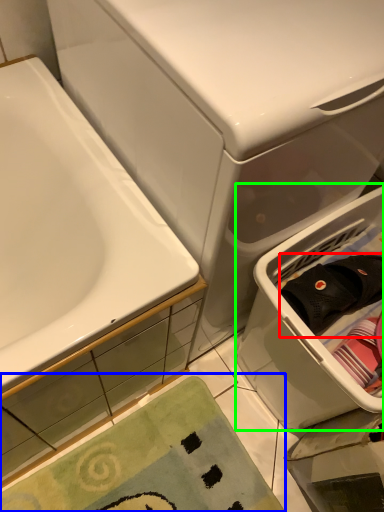
Question: Considering the real-world distances, which object is closest to clothing (highlighted by a red box)? bath mat (highlighted by a blue box) or laundry basket (highlighted by a green box).

Choices:
 (A) bath mat
 (B) laundry basket

Answer: (B)